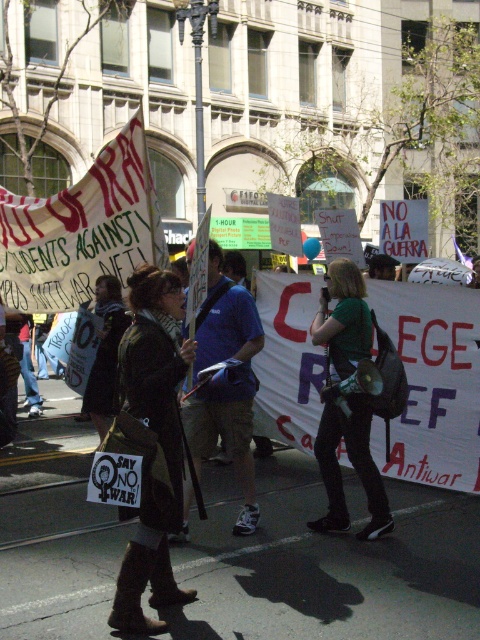
Question: Which object is farther from the camera taking this photo?

Choices:
 (A) dark brown leather boots at center
 (B) green matte shirt at center
 (C) blue fabric shirt at center

Answer: (B)

Question: Which object is positioned closest to the dark brown leather boots at center?

Choices:
 (A) green matte shirt at center
 (B) blue fabric shirt at center

Answer: (B)

Question: Considering the real-world distances, which object is closest to the dark brown leather boots at center?

Choices:
 (A) blue fabric shirt at center
 (B) green matte shirt at center

Answer: (A)

Question: Where is dark brown leather boots at center located in relation to blue fabric shirt at center in the image?

Choices:
 (A) right
 (B) left

Answer: (B)

Question: Can you confirm if dark brown leather boots at center is smaller than blue fabric shirt at center?

Choices:
 (A) no
 (B) yes

Answer: (B)

Question: Does dark brown leather boots at center have a larger size compared to blue fabric shirt at center?

Choices:
 (A) no
 (B) yes

Answer: (A)